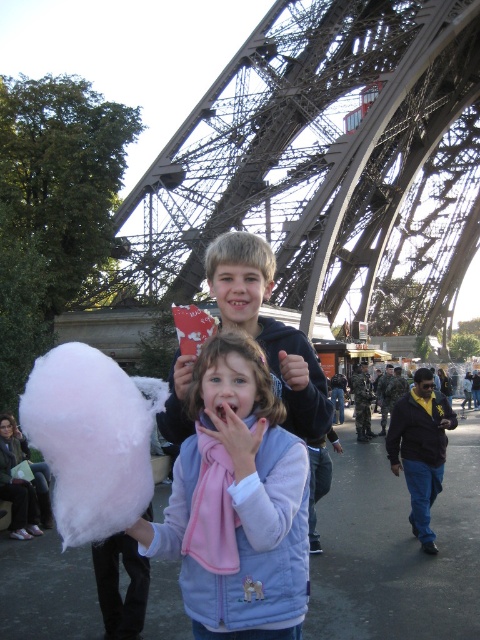
Question: Can you confirm if white fluffy cotton candy at lower left is bigger than dark blue jacket at center?

Choices:
 (A) yes
 (B) no

Answer: (A)

Question: Does dark blue jacket at center have a smaller size compared to pink fleece scarf at center?

Choices:
 (A) no
 (B) yes

Answer: (A)

Question: Considering the real-world distances, which object is farthest from the pink fleece scarf at center?

Choices:
 (A) metallic structure at center
 (B) light blue fleece vest at center
 (C) matte black hoodie at center
 (D) white fluffy cotton candy at lower left

Answer: (A)

Question: Is metallic structure at center to the left of white fluffy cotton candy at lower left from the viewer's perspective?

Choices:
 (A) no
 (B) yes

Answer: (A)

Question: Among these points, which one is nearest to the camera?

Choices:
 (A) (84, 515)
 (B) (204, 449)

Answer: (A)

Question: Considering the real-world distances, which object is farthest from the metallic structure at center?

Choices:
 (A) pink fleece scarf at center
 (B) matte black hoodie at center

Answer: (A)